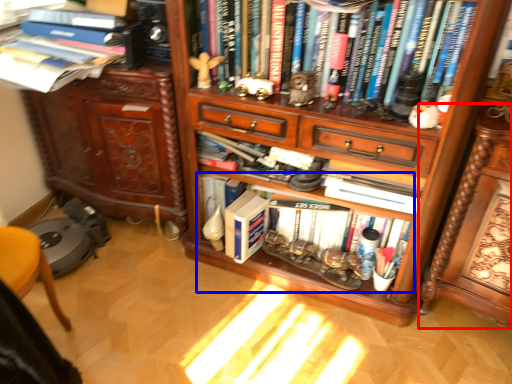
Question: Which object appears closest to the camera in this image, computer desk (highlighted by a red box) or book (highlighted by a blue box)?

Choices:
 (A) computer desk
 (B) book

Answer: (A)